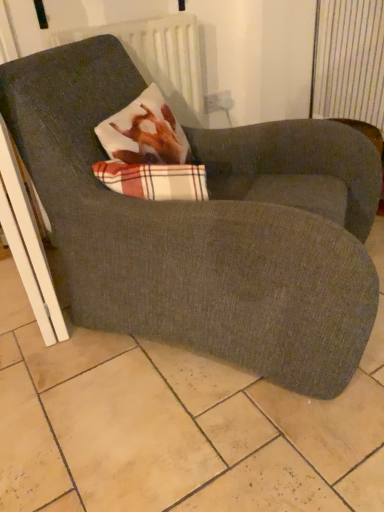
You are a GUI agent. You are given a task and a screenshot of the screen. Output one action in this format:
    pyautogui.click(x=<x>, y=<y>)
    Task: Click on the free point in front of dark gray fabric chair at center
    Image resolution: width=384 pixels, height=512 pixels.
    Given the screenshot: What is the action you would take?
    pyautogui.click(x=192, y=436)